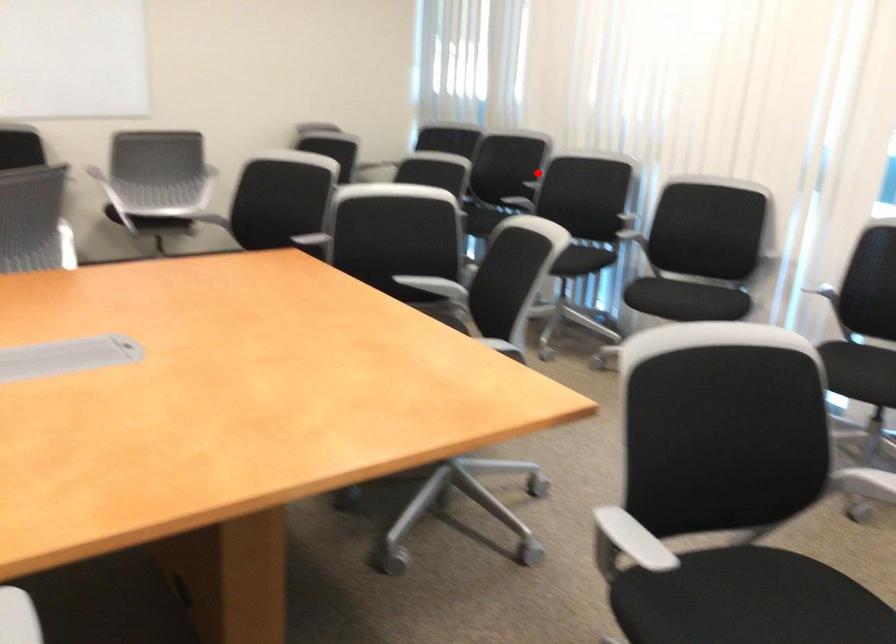
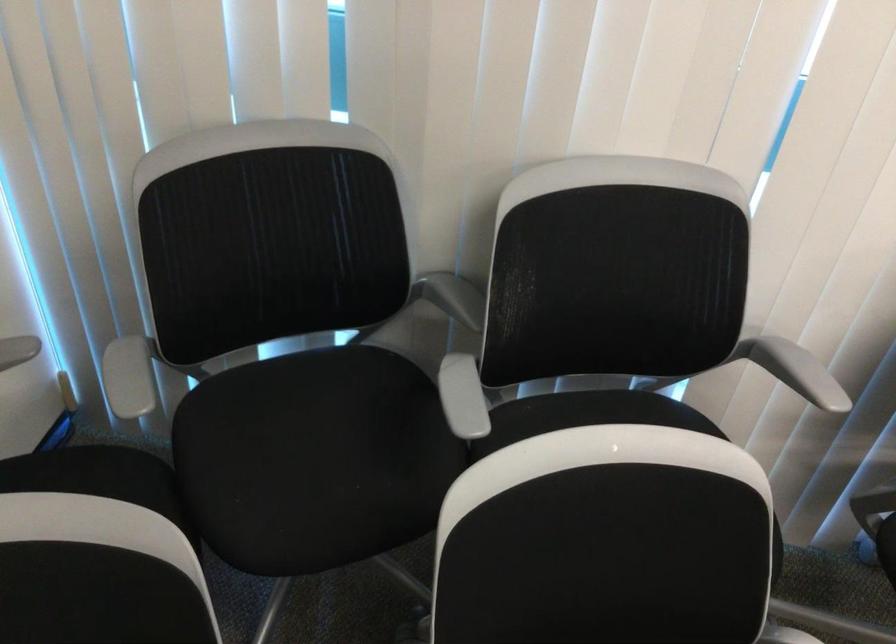
Question: I am providing you with two images of the same scene from different viewpoints. Given a red point in image1, look at the same physical point in image2. Is it:

Choices:
 (A) Closer to the viewpoint
 (B) Farther from the viewpoint

Answer: (A)